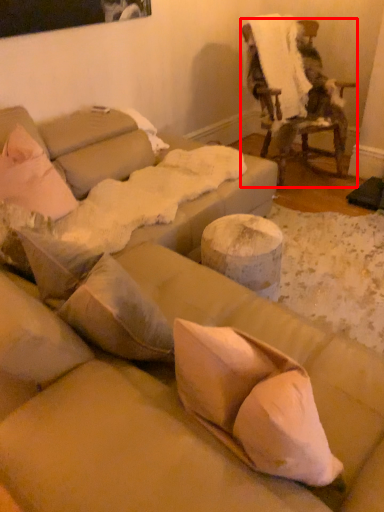
Question: Observing the image, what is the correct spatial positioning of chair (annotated by the red box) in reference to linen?

Choices:
 (A) left
 (B) right

Answer: (B)